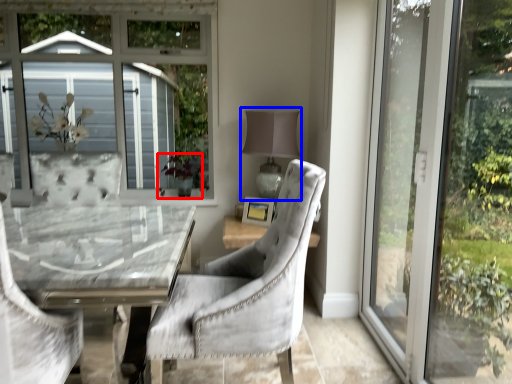
Question: Which point is further to the camera, plant (highlighted by a red box) or table lamp (highlighted by a blue box)?

Choices:
 (A) plant
 (B) table lamp

Answer: (A)